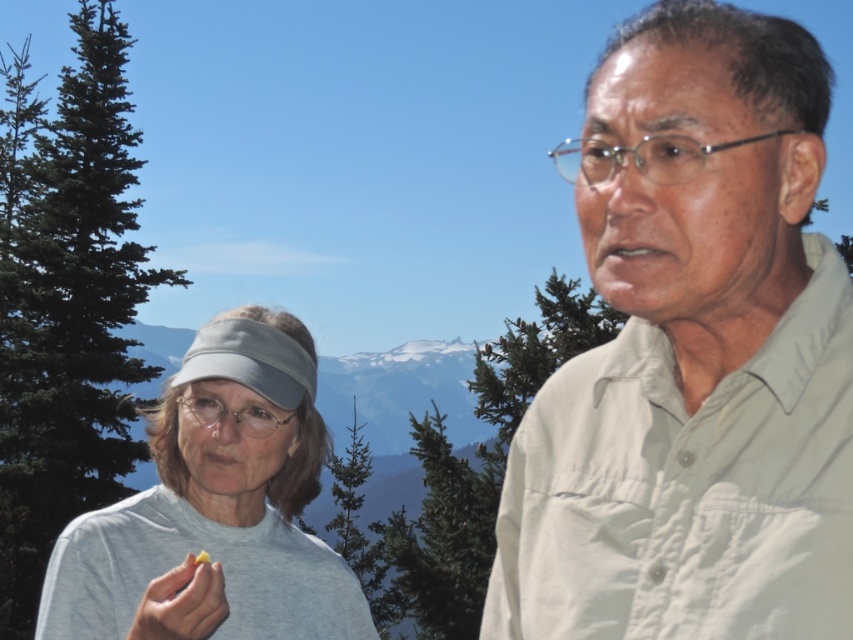
Between point (622, 172) and point (402, 524), which one is positioned behind?

The point (402, 524) is behind.

Between light beige shirt at right and green textured pine tree at center, which one has more height?

With more height is green textured pine tree at center.

Between point (735, 353) and point (436, 493), which one is positioned behind?

The point (436, 493) is behind.

Locate an element on the screen. light beige shirt at right is located at coordinates (693, 358).

Locate an element on the screen. This screenshot has width=853, height=640. green leafy tree at left is located at coordinates (67, 304).

Is green leafy tree at left smaller than green textured pine tree at center?

Actually, green leafy tree at left might be larger than green textured pine tree at center.

Locate an element on the screen. This screenshot has height=640, width=853. green leafy tree at left is located at coordinates (67, 304).

Locate an element on the screen. This screenshot has height=640, width=853. green leafy tree at left is located at coordinates (67, 304).

Is light beige shirt at right to the right of gray fabric visor at left from the viewer's perspective?

Indeed, light beige shirt at right is positioned on the right side of gray fabric visor at left.

Which is in front, point (770, 522) or point (164, 577)?

Point (770, 522) is in front.

Who is more distant from viewer, (776, 106) or (206, 424)?

Point (206, 424)

Where is `light beige shirt at right`? light beige shirt at right is located at coordinates (693, 358).